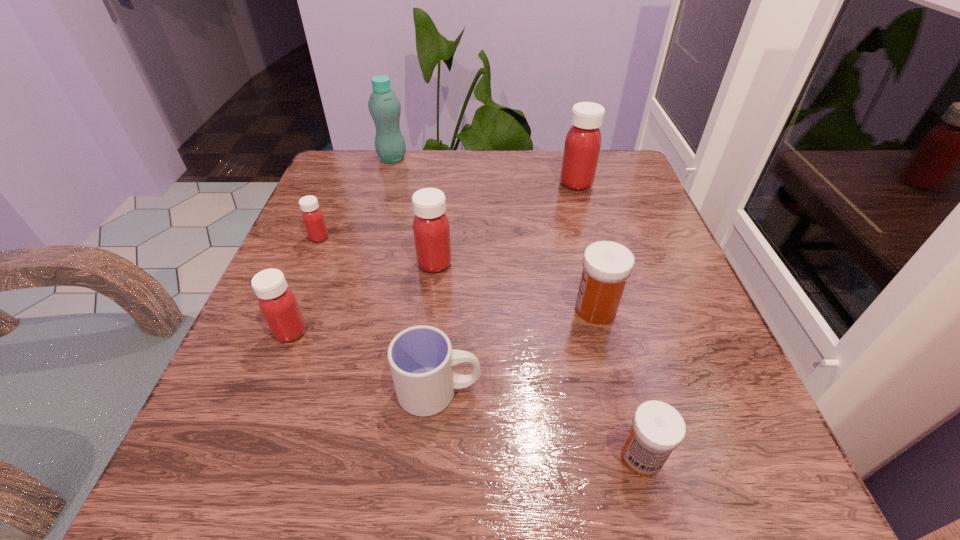
At what (x,y) coordinates should I click in order to perform the action: click on vacant point located on the back of the smaller white medicine. Please return your answer as a coordinate pair (x, y). The width and height of the screenshot is (960, 540). Looking at the image, I should click on (593, 275).

At what (x,y) coordinates should I click in order to perform the action: click on water bottle located in the far edge section of the desktop. Please return your answer as a coordinate pair (x, y). This screenshot has width=960, height=540. Looking at the image, I should click on (384, 106).

The image size is (960, 540). In order to click on medicine that is at the far edge in this screenshot , I will do pos(583,141).

Where is `object that is at the near edge`? Image resolution: width=960 pixels, height=540 pixels. object that is at the near edge is located at coordinates (657, 429).

Locate an element on the screen. This screenshot has height=540, width=960. water bottle at the left edge is located at coordinates (384, 106).

At what (x,y) coordinates should I click in order to perform the action: click on object that is positioned at the far left corner. Please return your answer as a coordinate pair (x, y). Image resolution: width=960 pixels, height=540 pixels. Looking at the image, I should click on (384, 106).

Identify the location of object that is at the far right corner. (583, 141).

What are the coordinates of `object present at the near right corner` in the screenshot? It's located at (657, 429).

Locate an element on the screen. vacant space at the far edge of the desktop is located at coordinates pyautogui.click(x=535, y=176).

You are a GUI agent. You are given a task and a screenshot of the screen. Output one action in this format:
    pyautogui.click(x=<x>, y=<y>)
    Task: Click on the vacant space at the near edge of the desktop
    This screenshot has height=540, width=960.
    Given the screenshot: What is the action you would take?
    pyautogui.click(x=615, y=471)